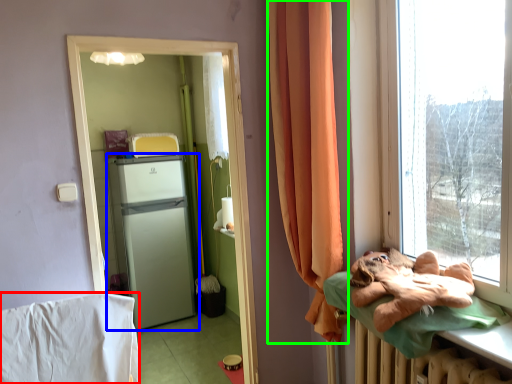
Question: Estimate the real-world distances between objects in this image. Which object is closer to blanket (highlighted by a red box), refrigerator (highlighted by a blue box) or curtain (highlighted by a green box)?

Choices:
 (A) refrigerator
 (B) curtain

Answer: (B)